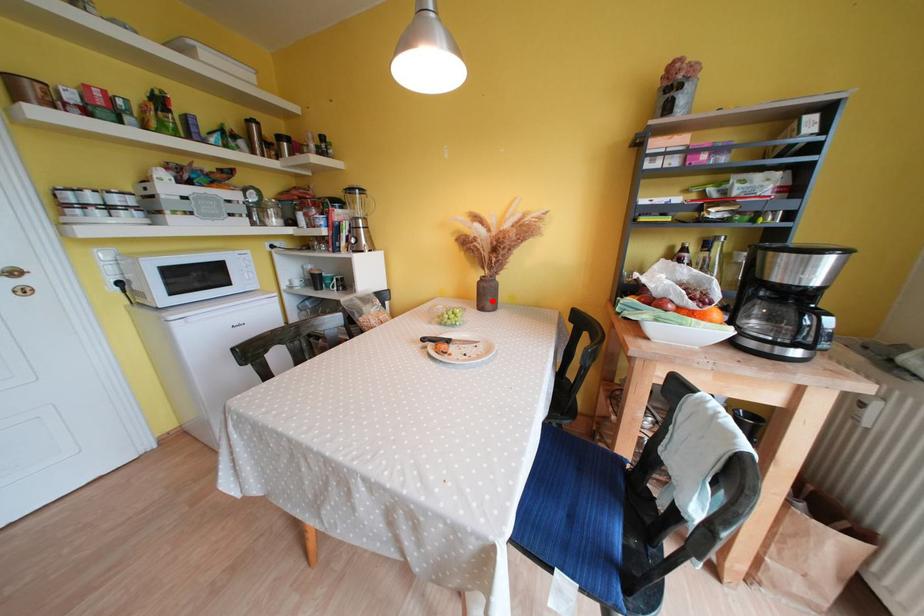
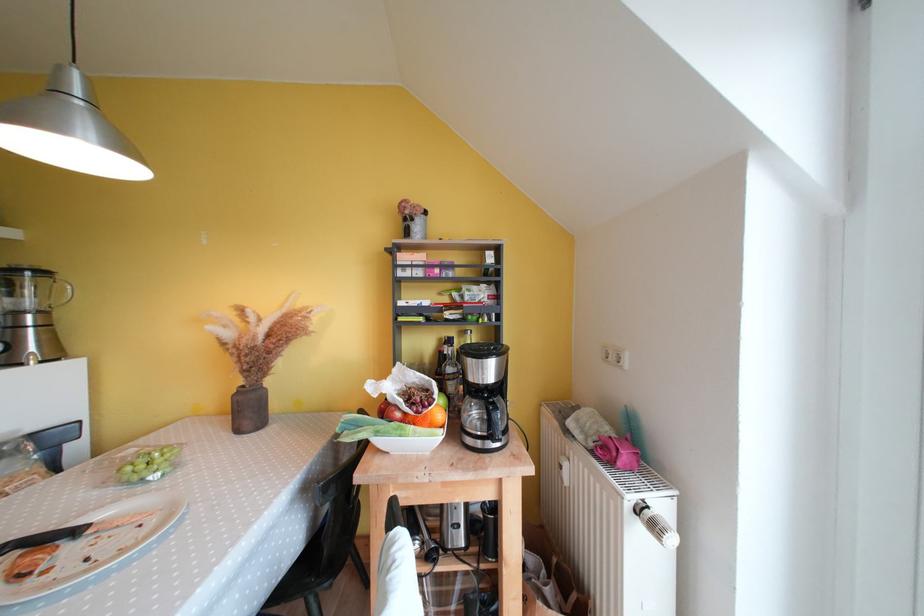
Find the pixel in the second image that matches the highlighted location in the first image.

(256, 416)